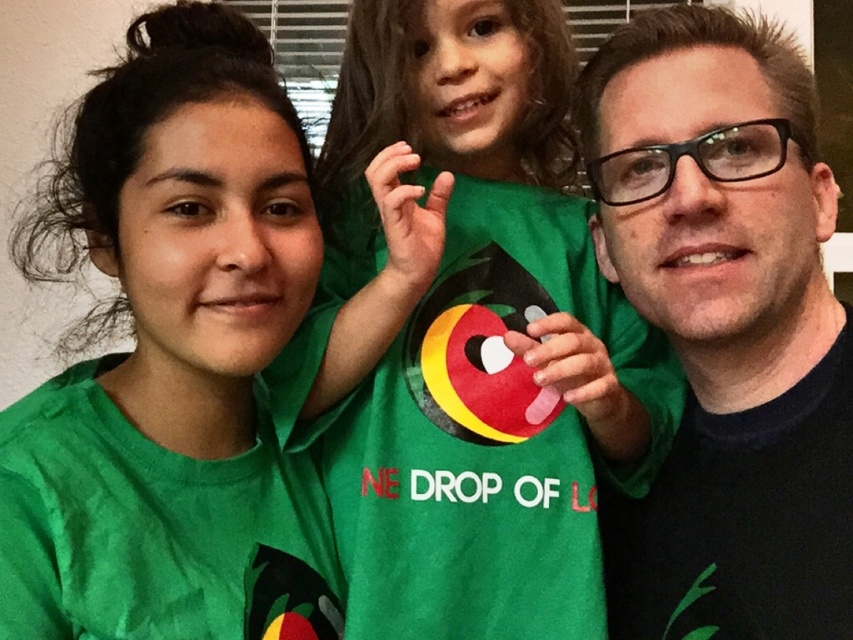
You are trying to decide which shirt to wear for an event. The green matte shirt at upper center and the black matte shirt at center are both options. Based on their sizes in the image, which one could potentially cover your shoulders more adequately?

The green matte shirt at upper center is wider than the black matte shirt at center, so it could potentially cover your shoulders more adequately.

You are a photographer adjusting the camera settings to ensure all three individuals in the group photo are in focus. The camera has a fixed focal point at the center of the image. Considering the positions of the green matte shirt at upper center and the other two individuals, will the focal point capture all three people clearly?

The green matte shirt at upper center is located at point (175, 362), which is near the center of the image. Since the camera focuses on the center, all three individuals should be in focus as they are posing closely together.